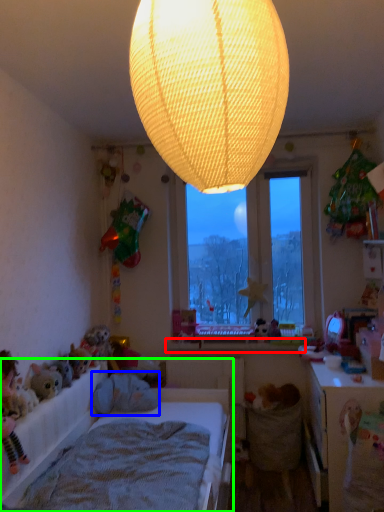
Question: Estimate the real-world distances between objects in this image. Which object is farther from window sill (highlighted by a red box), animal (highlighted by a blue box) or bed (highlighted by a green box)?

Choices:
 (A) animal
 (B) bed

Answer: (B)